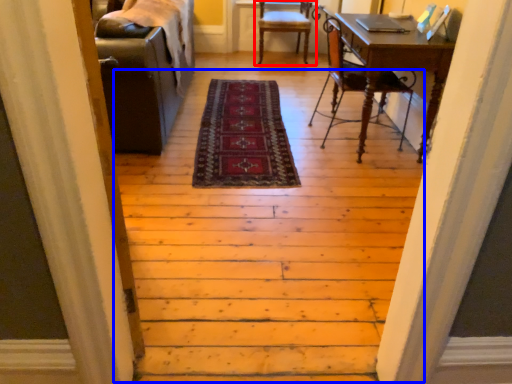
Question: Which of the following is the farthest to the observer, chair (highlighted by a red box) or stairwell (highlighted by a blue box)?

Choices:
 (A) chair
 (B) stairwell

Answer: (A)